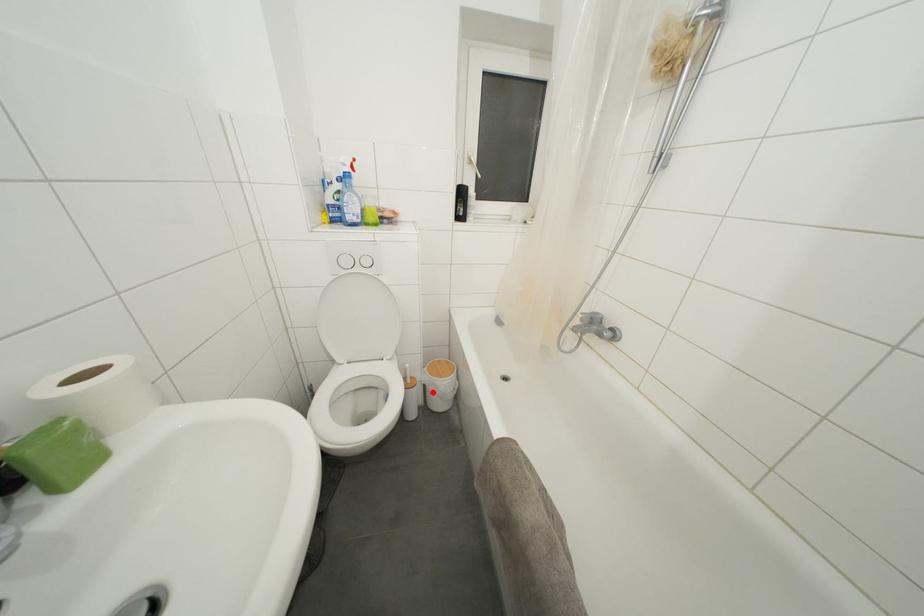
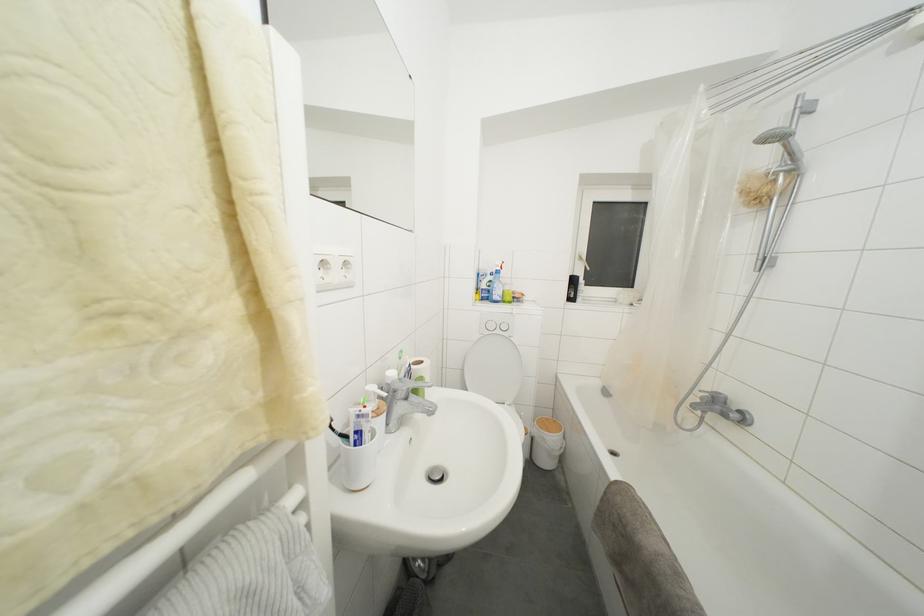
Question: I am providing you with two images of the same scene from different viewpoints. A red point is shown in image1. For the corresponding object point in image2, is it positioned nearer or farther from the camera?

Choices:
 (A) Nearer
 (B) Farther

Answer: (B)